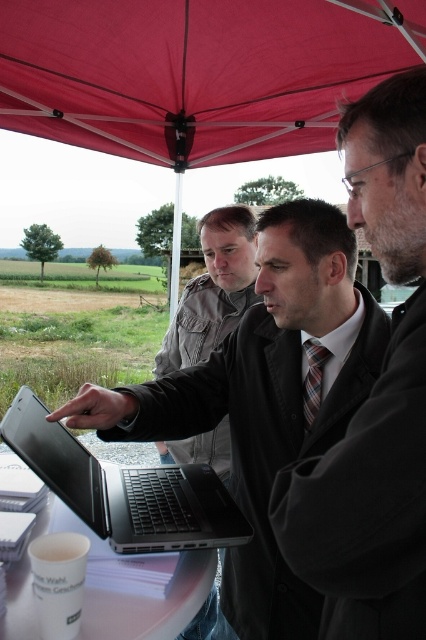
Which is below, red fabric umbrella at upper center or black matte laptop at center?

Positioned lower is black matte laptop at center.

Can you confirm if red fabric umbrella at upper center is positioned to the right of black matte laptop at center?

Yes, red fabric umbrella at upper center is to the right of black matte laptop at center.

This screenshot has width=426, height=640. I want to click on red fabric umbrella at upper center, so click(196, 74).

Who is lower down, matte black laptop at center or black matte laptop at center?

black matte laptop at center

Who is positioned more to the left, matte black laptop at center or black matte laptop at center?

Positioned to the left is black matte laptop at center.

The height and width of the screenshot is (640, 426). Identify the location of matte black laptop at center. (264, 397).

Can you confirm if dark gray suit at center is positioned above black matte laptop at center?

Indeed, dark gray suit at center is positioned over black matte laptop at center.

Which is more to the right, dark gray suit at center or black matte laptop at center?

dark gray suit at center

Between point (333, 516) and point (45, 474), which one is positioned in front?

Point (333, 516) is more forward.

Where is `dark gray suit at center`? dark gray suit at center is located at coordinates (374, 401).